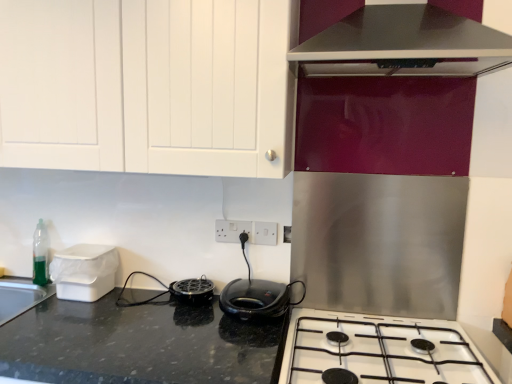
Question: Does white plastic electric outlet at center, placed as the first electric outlet when sorted from left to right, have a lesser width compared to white glossy gas stove at lower center?

Choices:
 (A) no
 (B) yes

Answer: (B)

Question: Is white plastic electric outlet at center, the 2th electric outlet when ordered from right to left, facing away from white glossy gas stove at lower center?

Choices:
 (A) no
 (B) yes

Answer: (A)

Question: Could you tell me if white plastic electric outlet at center, placed as the first electric outlet when sorted from left to right, is facing white glossy gas stove at lower center?

Choices:
 (A) no
 (B) yes

Answer: (A)

Question: Is the position of white plastic electric outlet at center, the 2th electric outlet when ordered from right to left, more distant than that of white glossy gas stove at lower center?

Choices:
 (A) no
 (B) yes

Answer: (B)

Question: Is white plastic electric outlet at center, placed as the first electric outlet when sorted from left to right, positioned before white glossy gas stove at lower center?

Choices:
 (A) no
 (B) yes

Answer: (A)

Question: Is point (407, 347) positioned closer to the camera than point (182, 291)?

Choices:
 (A) farther
 (B) closer

Answer: (B)

Question: Considering their positions, is white glossy gas stove at lower center located in front of or behind black matte grill at center, the 2th kitchen appliance from the right?

Choices:
 (A) front
 (B) behind

Answer: (A)

Question: Based on their positions, is white glossy gas stove at lower center located to the left or right of black matte grill at center, which appears as the 1th kitchen appliance when viewed from the left?

Choices:
 (A) right
 (B) left

Answer: (A)

Question: In terms of size, does white glossy gas stove at lower center appear bigger or smaller than black matte grill at center, the 2th kitchen appliance from the right?

Choices:
 (A) small
 (B) big

Answer: (B)

Question: Looking at their shapes, would you say black matte grill at center, which appears as the 1th kitchen appliance when viewed from the left, is wider or thinner than white plastic container at left?

Choices:
 (A) thin
 (B) wide

Answer: (A)

Question: From the image's perspective, is black matte grill at center, the 2th kitchen appliance from the right, above or below white plastic container at left?

Choices:
 (A) below
 (B) above

Answer: (A)

Question: Considering the positions of point (197, 294) and point (68, 248), is point (197, 294) closer or farther from the camera than point (68, 248)?

Choices:
 (A) closer
 (B) farther

Answer: (A)

Question: Is black matte grill at center, which appears as the 1th kitchen appliance when viewed from the left, to the left or to the right of white plastic container at left in the image?

Choices:
 (A) left
 (B) right

Answer: (B)

Question: From the image's perspective, is black glossy range hood at upper right above or below white glossy gas stove at lower center?

Choices:
 (A) above
 (B) below

Answer: (A)

Question: In terms of height, does black glossy range hood at upper right look taller or shorter compared to white glossy gas stove at lower center?

Choices:
 (A) short
 (B) tall

Answer: (B)